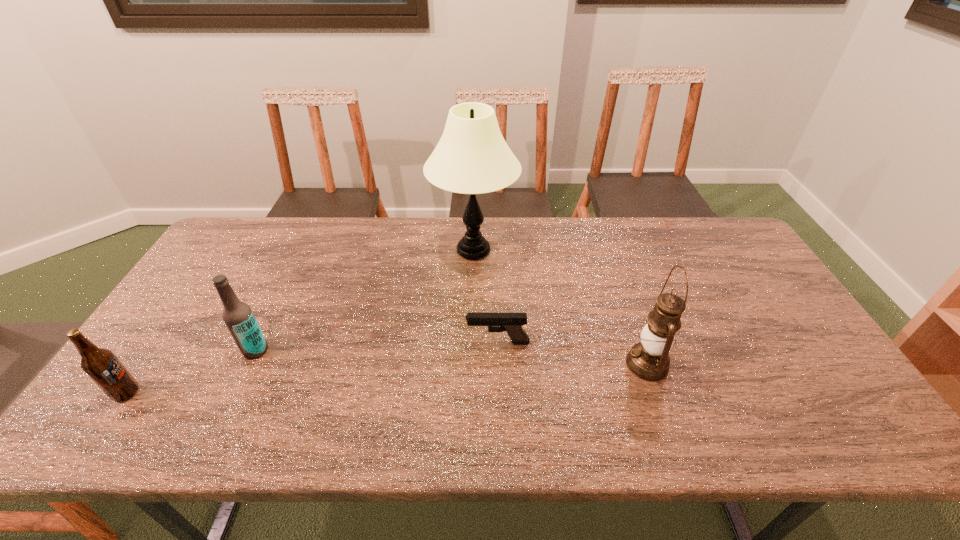
Find the location of a particular element. The height and width of the screenshot is (540, 960). vacant area that lies between the farthest object and the shorter beer bottle is located at coordinates (300, 322).

Where is `free space between the nearer beer bottle and the oil lamp`? free space between the nearer beer bottle and the oil lamp is located at coordinates (387, 379).

Identify the location of free space between the tallest object and the pistol. The width and height of the screenshot is (960, 540). (486, 296).

Locate an element on the screen. Image resolution: width=960 pixels, height=540 pixels. free point between the oil lamp and the lamp is located at coordinates (561, 307).

Identify which object is located as the nearest to the leftmost object. Please provide its 2D coordinates. Your answer should be formatted as a tuple, i.e. [(x, y)], where the tuple contains the x and y coordinates of a point satisfying the conditions above.

[(238, 316)]

Point out which object is positioned as the third nearest to the tallest object. Please provide its 2D coordinates. Your answer should be formatted as a tuple, i.e. [(x, y)], where the tuple contains the x and y coordinates of a point satisfying the conditions above.

[(238, 316)]

Identify the location of free location that satisfies the following two spatial constraints: 1. on the label of the right beer bottle; 2. on the right side of the fourth shortest object. (249, 364).